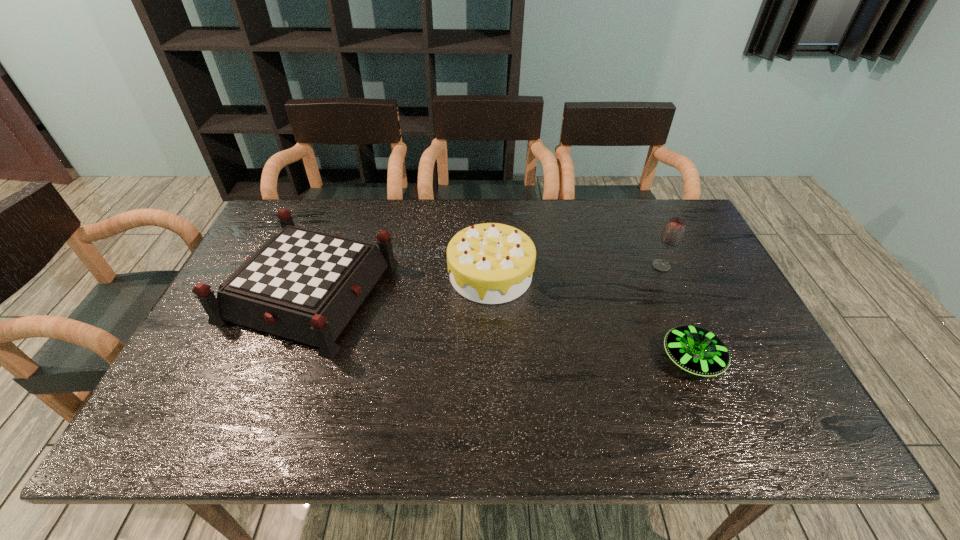
You are a GUI agent. You are given a task and a screenshot of the screen. Output one action in this format:
    pyautogui.click(x=<x>, y=<y>)
    Task: Click on the free space between the shortest object and the glass drink container
    
    Given the screenshot: What is the action you would take?
    pyautogui.click(x=677, y=313)

You are a GUI agent. You are given a task and a screenshot of the screen. Output one action in this format:
    pyautogui.click(x=<x>, y=<y>)
    Task: Click on the empty location between the shortest object and the glass drink container
    The image size is (960, 540).
    Given the screenshot: What is the action you would take?
    pyautogui.click(x=677, y=313)

The width and height of the screenshot is (960, 540). I want to click on vacant area that lies between the birthday cake and the glass drink container, so click(x=576, y=270).

Locate an element on the screen. free space between the saucer and the third object from right to left is located at coordinates (591, 317).

Find the location of `vacant area that lies between the saucer and the leftmost object`. vacant area that lies between the saucer and the leftmost object is located at coordinates (501, 325).

Identify the location of free space between the shortest object and the glass drink container. This screenshot has height=540, width=960. (677, 313).

Locate an element on the screen. This screenshot has height=540, width=960. unoccupied area between the birthday cake and the checkerboard is located at coordinates (400, 283).

Locate which object is the second closest to the glass drink container. Please provide its 2D coordinates. Your answer should be formatted as a tuple, i.e. [(x, y)], where the tuple contains the x and y coordinates of a point satisfying the conditions above.

[(490, 263)]

Point out which object is positioned as the third nearest to the glass drink container. Please provide its 2D coordinates. Your answer should be formatted as a tuple, i.e. [(x, y)], where the tuple contains the x and y coordinates of a point satisfying the conditions above.

[(304, 285)]

Locate an element on the screen. This screenshot has width=960, height=540. blank space that satisfies the following two spatial constraints: 1. on the back side of the birthday cake; 2. on the left side of the checkerboard is located at coordinates (316, 275).